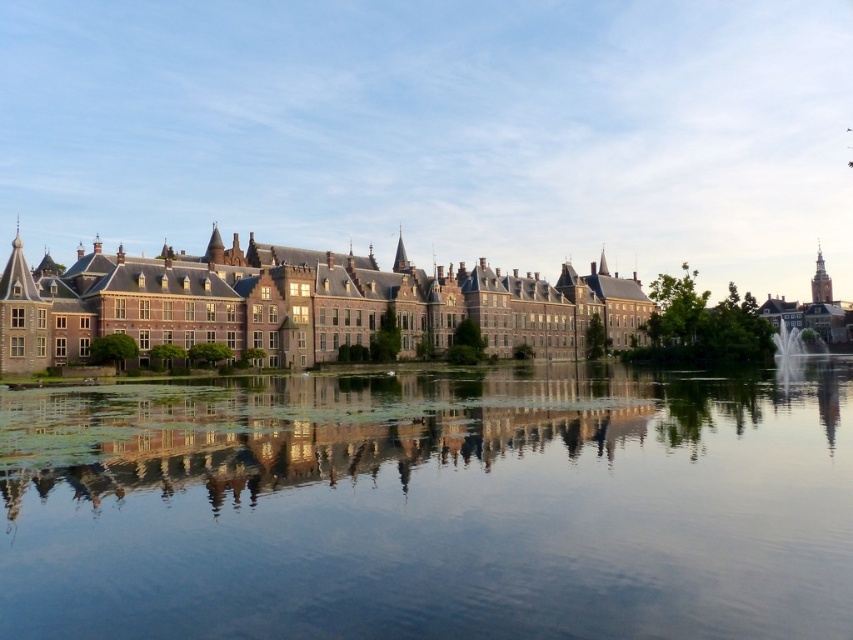
Question: Which of the following is the closest to the observer?

Choices:
 (A) (343, 486)
 (B) (219, 243)

Answer: (A)

Question: Is transparent glass water at center in front of brick stone palace at center?

Choices:
 (A) no
 (B) yes

Answer: (B)

Question: Is transparent glass water at center closer to the viewer compared to brick stone palace at center?

Choices:
 (A) no
 (B) yes

Answer: (B)

Question: Does transparent glass water at center have a lesser width compared to brick stone palace at center?

Choices:
 (A) no
 (B) yes

Answer: (B)